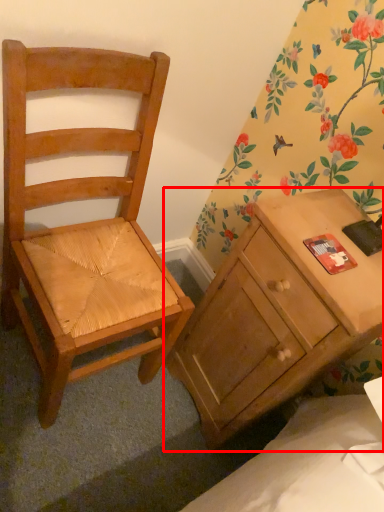
Question: From the image's perspective, where is desk (annotated by the red box) located in relation to chair in the image?

Choices:
 (A) below
 (B) above

Answer: (A)